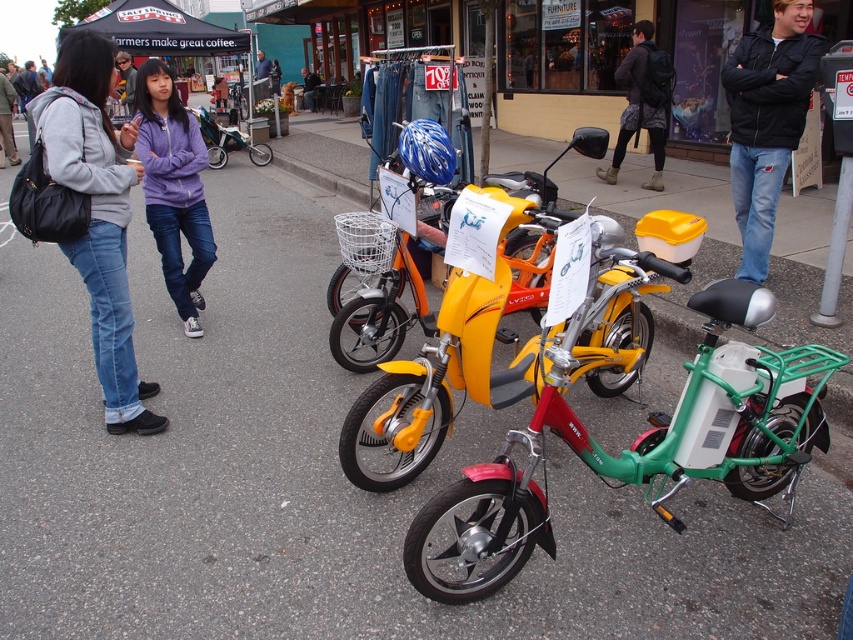
How distant is yellow matte/metallic scooter at center from purple fleece jacket at upper left?

yellow matte/metallic scooter at center is 8.92 feet from purple fleece jacket at upper left.

Is point (610, 275) positioned behind point (155, 234)?

No, it is not.

At what (x,y) coordinates should I click in order to perform the action: click on yellow matte/metallic scooter at center. Please return your answer as a coordinate pair (x, y). Looking at the image, I should click on (491, 356).

Between point (526, 352) and point (134, 72), which one is positioned in front?

Positioned in front is point (526, 352).

Where is `yellow matte/metallic scooter at center`? This screenshot has width=853, height=640. yellow matte/metallic scooter at center is located at coordinates (491, 356).

Does purple fleece jacket at upper left lie behind matte purple hoodie at center?

No, purple fleece jacket at upper left is closer to the viewer.

Is purple fleece jacket at upper left wider than matte purple hoodie at center?

Yes.

Locate an element on the screen. purple fleece jacket at upper left is located at coordinates (173, 188).

Find the location of a particular element. This screenshot has width=853, height=640. purple fleece jacket at upper left is located at coordinates (173, 188).